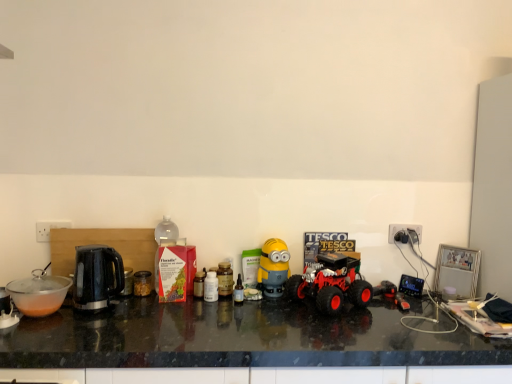
What do you see at coordinates (403, 230) in the screenshot?
I see `black plastic power outlet at right` at bounding box center [403, 230].

Where is `red matte truck at center, which ranks as the first toy in right-to-left order`? red matte truck at center, which ranks as the first toy in right-to-left order is located at coordinates (391, 294).

Locate an element on the screen. translucent plastic bottle at center, arranged as the 3th bottle when viewed from the left is located at coordinates (238, 292).

Identify the location of black plastic power outlet at right. (403, 230).

Which is behind, transparent plastic bowl at left or black plastic kettle at left?

black plastic kettle at left is more distant.

Is transparent plastic bowl at left not inside black plastic kettle at left?

transparent plastic bowl at left lies outside black plastic kettle at left's area.

Is black plastic power outlet at right oriented towards red matte truck at center, which ranks as the first toy in right-to-left order?

No, black plastic power outlet at right is not oriented towards red matte truck at center, which ranks as the first toy in right-to-left order.

Is red matte truck at center, which ranks as the first toy in right-to-left order, inside black plastic power outlet at right?

Actually, red matte truck at center, which ranks as the first toy in right-to-left order, is outside black plastic power outlet at right.

Which object is more forward, black plastic power outlet at right or red matte truck at center, the second toy positioned from the left?

Positioned in front is red matte truck at center, the second toy positioned from the left.

From a real-world perspective, which is physically below, black plastic power outlet at right or red matte truck at center, which ranks as the first toy in right-to-left order?

red matte truck at center, which ranks as the first toy in right-to-left order.

Considering the sizes of white plastic bottle at center, arranged as the 1th bottle when viewed from the left, and yellow matte minion at center, acting as the 1th toy starting from the left, in the image, is white plastic bottle at center, arranged as the 1th bottle when viewed from the left, wider or thinner than yellow matte minion at center, acting as the 1th toy starting from the left,?

white plastic bottle at center, arranged as the 1th bottle when viewed from the left, is thinner than yellow matte minion at center, acting as the 1th toy starting from the left.

Which is nearer, (210, 280) or (271, 258)?

The point (210, 280) is more forward.

From the image's perspective, is white plastic bottle at center, arranged as the 1th bottle when viewed from the left, below yellow matte minion at center, arranged as the 2th toy when viewed from the right?

Yes, from the image's perspective, white plastic bottle at center, arranged as the 1th bottle when viewed from the left, is below yellow matte minion at center, arranged as the 2th toy when viewed from the right.

Is white plastic bottle at center, which is the third bottle in right-to-left order, directly adjacent to yellow matte minion at center, acting as the 1th toy starting from the left?

No, white plastic bottle at center, which is the third bottle in right-to-left order, is not beside yellow matte minion at center, acting as the 1th toy starting from the left.

Considering the relative positions of rubberized red toy truck at center and translucent plastic bottle at center, positioned as the first bottle in right-to-left order, in the image provided, is rubberized red toy truck at center in front of translucent plastic bottle at center, positioned as the first bottle in right-to-left order,?

Yes, it is.

Looking at this image, which is further, (x=301, y=294) or (x=240, y=289)?

The point (x=240, y=289) is behind.

Is rubberized red toy truck at center oriented away from translucent plastic bottle at center, arranged as the 3th bottle when viewed from the left?

No, translucent plastic bottle at center, arranged as the 3th bottle when viewed from the left, is not at the back of rubberized red toy truck at center.

From a real-world perspective, is rubberized red toy truck at center physically located above or below translucent plastic bottle at center, positioned as the first bottle in right-to-left order?

rubberized red toy truck at center is above translucent plastic bottle at center, positioned as the first bottle in right-to-left order.

From the picture: Relative to translucent plastic bottle at center, which is the second bottle in right-to-left order, is red matte truck at center, the second toy positioned from the left, in front or behind?

Visually, red matte truck at center, the second toy positioned from the left, is located in front of translucent plastic bottle at center, which is the second bottle in right-to-left order.

Is red matte truck at center, the second toy positioned from the left, next to translucent plastic bottle at center, which ranks as the 2th bottle in left-to-right order, and touching it?

red matte truck at center, the second toy positioned from the left, is not next to translucent plastic bottle at center, which ranks as the 2th bottle in left-to-right order, and they're not touching.

Is point (381, 294) positioned after point (224, 273)?

Yes, it is behind point (224, 273).

You are a GUI agent. You are given a task and a screenshot of the screen. Output one action in this format:
    pyautogui.click(x=<x>, y=<y>)
    Task: Click on the 2nd bottle to the left of the red matte truck at center, which ranks as the first toy in right-to-left order, starting your count from the anchor
    The width and height of the screenshot is (512, 384).
    Given the screenshot: What is the action you would take?
    pyautogui.click(x=225, y=279)

Can you tell me how much black granite countertop at center and red matte truck at center, which ranks as the first toy in right-to-left order, differ in facing direction?

0.000297 degrees.

In the scene shown: Is black granite countertop at center beside red matte truck at center, the second toy positioned from the left?

There is a gap between black granite countertop at center and red matte truck at center, the second toy positioned from the left.

How far apart are black granite countertop at center and red matte truck at center, which ranks as the first toy in right-to-left order?

black granite countertop at center and red matte truck at center, which ranks as the first toy in right-to-left order, are 26.68 inches apart from each other.

Looking at their sizes, would you say black granite countertop at center is wider or thinner than red matte truck at center, the second toy positioned from the left?

Considering their sizes, black granite countertop at center looks broader than red matte truck at center, the second toy positioned from the left.

Based on the photo, from the image's perspective, which one is positioned lower, translucent plastic bottle at center, which is the second bottle in right-to-left order, or translucent plastic bottle at center, arranged as the 3th bottle when viewed from the left?

translucent plastic bottle at center, arranged as the 3th bottle when viewed from the left, from the image's perspective.

Is translucent plastic bottle at center, which is the second bottle in right-to-left order, turned away from translucent plastic bottle at center, positioned as the first bottle in right-to-left order?

No, translucent plastic bottle at center, which is the second bottle in right-to-left order,'s orientation is not away from translucent plastic bottle at center, positioned as the first bottle in right-to-left order.

Which object is further away from the camera, translucent plastic bottle at center, which ranks as the 2th bottle in left-to-right order, or translucent plastic bottle at center, arranged as the 3th bottle when viewed from the left?

translucent plastic bottle at center, which ranks as the 2th bottle in left-to-right order, is behind.

You are a GUI agent. You are given a task and a screenshot of the screen. Output one action in this format:
    pyautogui.click(x=<x>, y=<y>)
    Task: Click on the kettle on the right of transparent plastic bowl at left
    The height and width of the screenshot is (384, 512).
    Given the screenshot: What is the action you would take?
    pyautogui.click(x=96, y=277)

At what (x,y) coordinates should I click in order to perform the action: click on power outlet above the red matte truck at center, the second toy positioned from the left (from the image's perspective). Please return your answer as a coordinate pair (x, y). Looking at the image, I should click on pyautogui.click(x=403, y=230).

When comparing their distances from translucent plastic bottle at center, which is the second bottle in right-to-left order, does translucent plastic bottle at center, positioned as the first bottle in right-to-left order, or black plastic kettle at left seem further?

black plastic kettle at left.

Estimate the real-world distances between objects in this image. Which object is further from translucent plastic bottle at center, positioned as the first bottle in right-to-left order, red matte truck at center, the second toy positioned from the left, or black granite countertop at center?

red matte truck at center, the second toy positioned from the left.

Estimate the real-world distances between objects in this image. Which object is further from red matte truck at center, the second toy positioned from the left, white plastic bottle at center, arranged as the 1th bottle when viewed from the left, or black plastic power outlet at right?

Among the two, white plastic bottle at center, arranged as the 1th bottle when viewed from the left, is located further to red matte truck at center, the second toy positioned from the left.

From the image, which object appears to be farther from black plastic power outlet at right, rubberized red toy truck at center or red matte truck at center, the second toy positioned from the left?

Result: rubberized red toy truck at center is further to black plastic power outlet at right.

Considering their positions, is black plastic kettle at left positioned closer to red matte truck at center, the second toy positioned from the left, than rubberized red toy truck at center?

rubberized red toy truck at center.

When comparing their distances from black plastic power outlet at right, does black granite countertop at center or red matte truck at center, which ranks as the first toy in right-to-left order, seem closer?

red matte truck at center, which ranks as the first toy in right-to-left order, is positioned closer to the anchor black plastic power outlet at right.

Considering their positions, is black plastic power outlet at right positioned closer to white plastic bottle at center, which is the third bottle in right-to-left order, than yellow matte minion at center, arranged as the 2th toy when viewed from the right?

yellow matte minion at center, arranged as the 2th toy when viewed from the right, lies closer to white plastic bottle at center, which is the third bottle in right-to-left order, than the other object.

Considering their positions, is black plastic power outlet at right positioned closer to black granite countertop at center than rubberized red toy truck at center?

rubberized red toy truck at center is positioned closer to the anchor black granite countertop at center.

I want to click on countertop between white plastic bottle at center, arranged as the 1th bottle when viewed from the left, and rubberized red toy truck at center, so click(x=237, y=338).

The height and width of the screenshot is (384, 512). I want to click on toy located between transparent plastic bowl at left and rubberized red toy truck at center in the left-right direction, so [273, 268].

Image resolution: width=512 pixels, height=384 pixels. Identify the location of land vehicle between black granite countertop at center and translucent plastic bottle at center, arranged as the 3th bottle when viewed from the left, from front to back. (331, 283).

In order to click on countertop situated between white plastic bottle at center, arranged as the 1th bottle when viewed from the left, and red matte truck at center, which ranks as the first toy in right-to-left order, from left to right in this screenshot , I will do `click(237, 338)`.